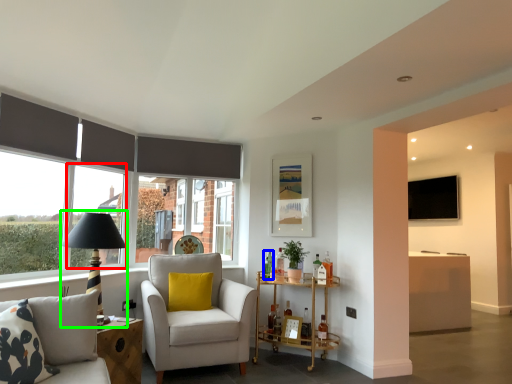
Question: Based on their relative distances, which object is farther from window (highlighted by a red box)? Choose from bottle (highlighted by a blue box) and table lamp (highlighted by a green box).

Choices:
 (A) bottle
 (B) table lamp

Answer: (A)